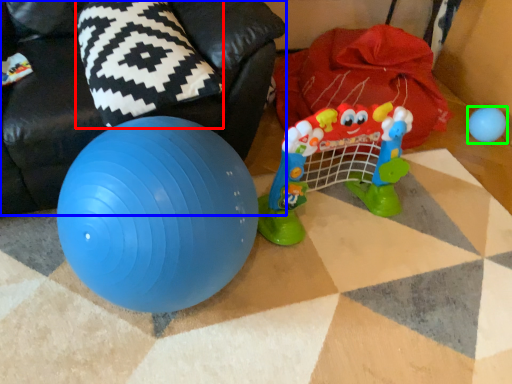
Question: Which is nearer to the pillow (highlighted by a red box)? bean bag chair (highlighted by a blue box) or toy (highlighted by a green box).

Choices:
 (A) bean bag chair
 (B) toy

Answer: (A)